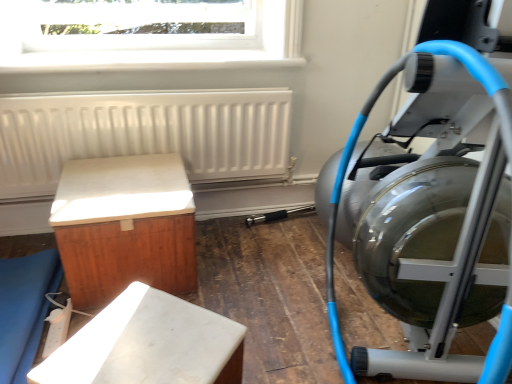
You are a GUI agent. You are given a task and a screenshot of the screen. Output one action in this format:
    pyautogui.click(x=<x>, y=<y>)
    Task: Click on the blank space situated above white marble bench at lower center, the first furniture from the right (from a real-world perspective)
    
    Given the screenshot: What is the action you would take?
    tap(145, 342)